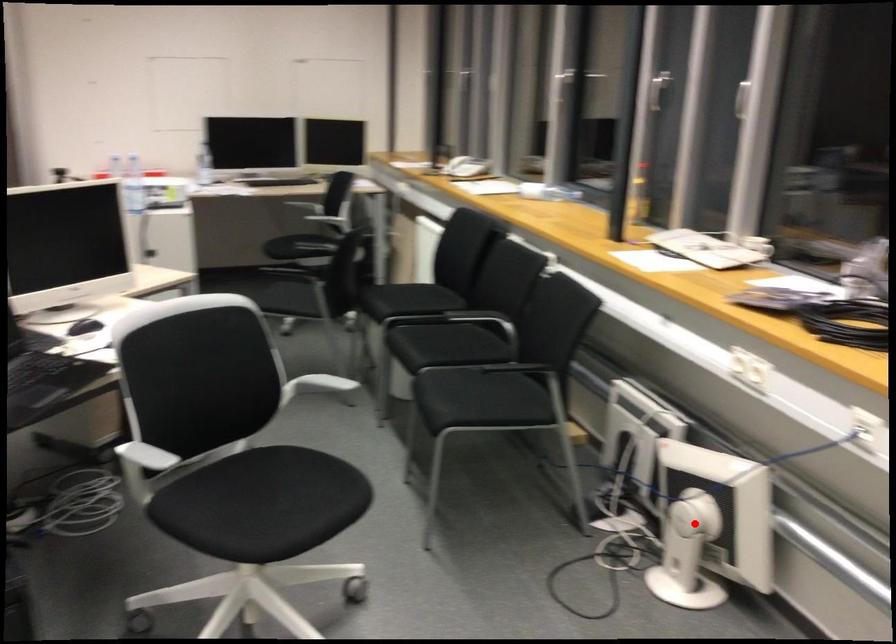
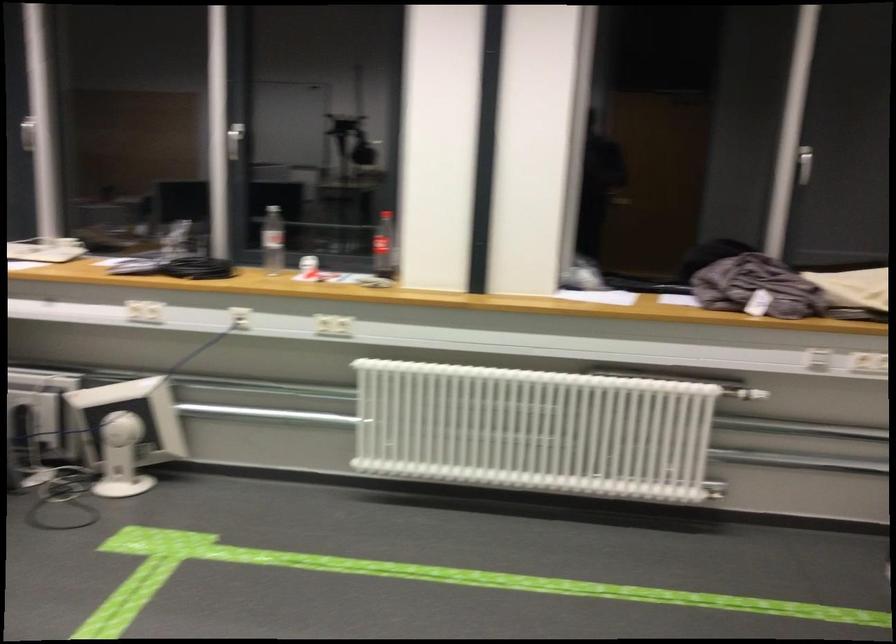
Question: I am providing you with two images of the same scene from different viewpoints. A red point is shown in image1. For the corresponding object point in image2, is it positioned nearer or farther from the camera?

Choices:
 (A) Nearer
 (B) Farther

Answer: (B)